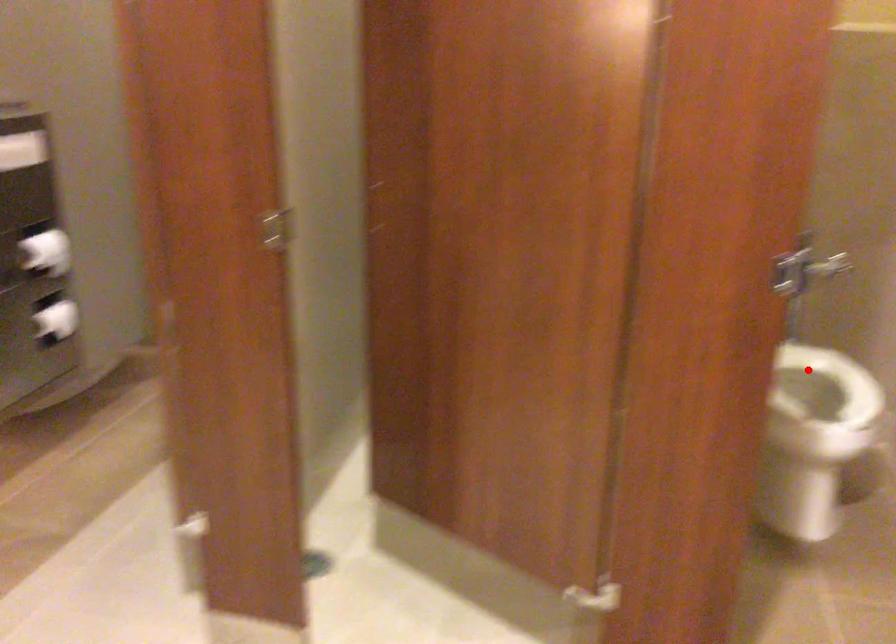
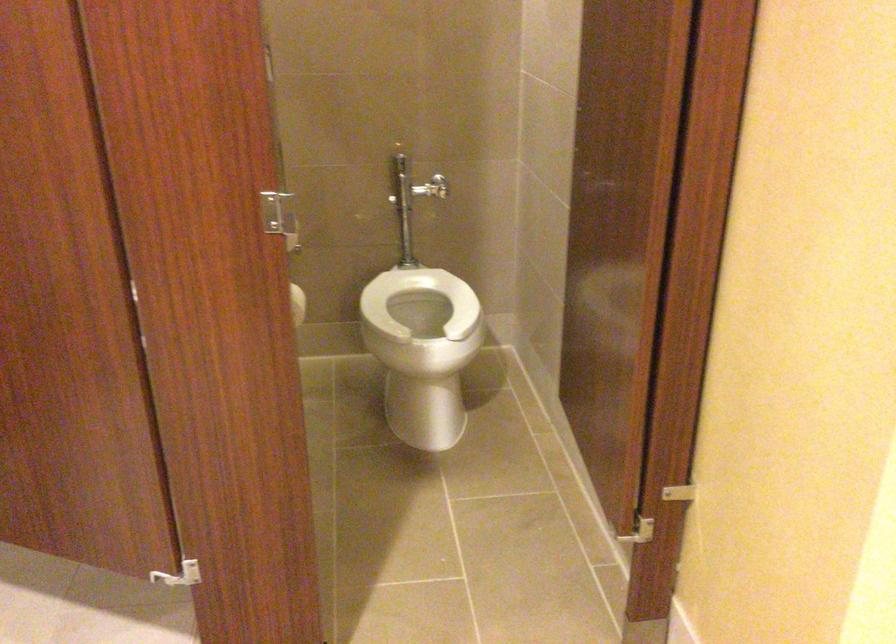
Locate, in the second image, the point that corresponds to the highlighted location in the first image.

(419, 301)